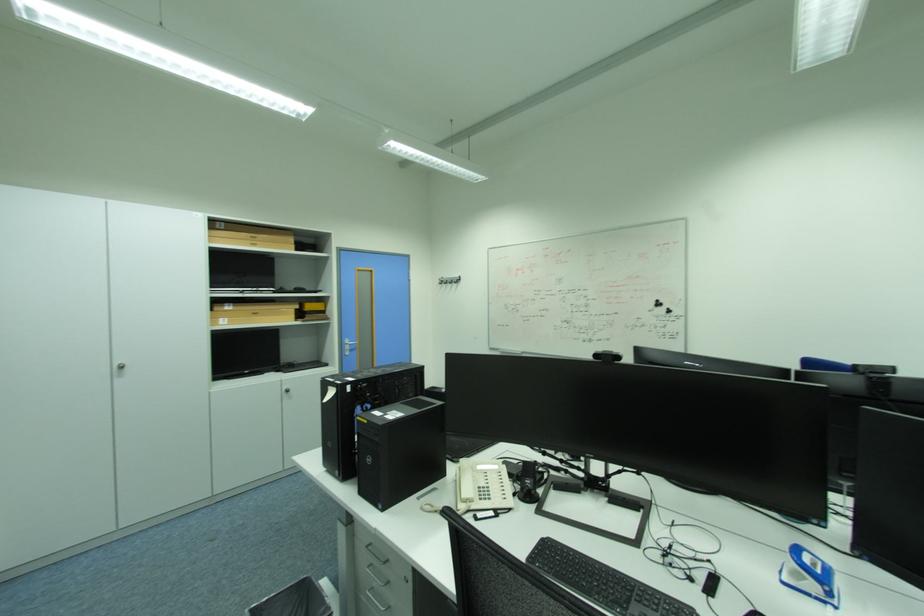
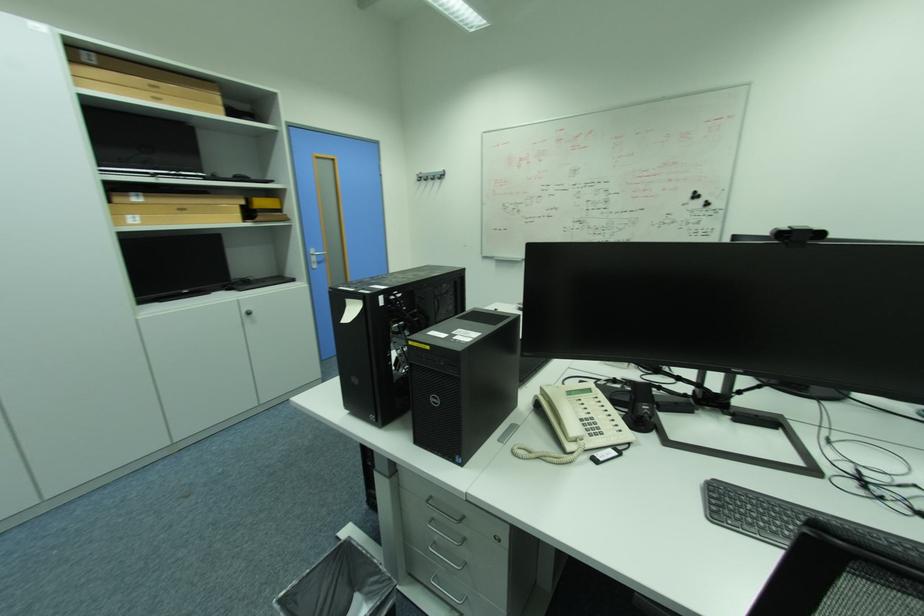
Which direction would the cameraman need to move to produce the second image?

The cameraman moved toward left, forward.